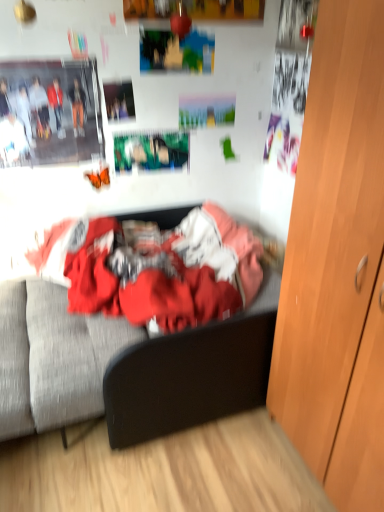
Question: Considering the positions of textured fabric bed at center and wooden cabinet at right in the image, is textured fabric bed at center taller or shorter than wooden cabinet at right?

Choices:
 (A) short
 (B) tall

Answer: (A)

Question: From a real-world perspective, is textured fabric bed at center above or below wooden cabinet at right?

Choices:
 (A) above
 (B) below

Answer: (B)

Question: Which is correct: textured fabric bed at center is inside wooden cabinet at right, or outside of it?

Choices:
 (A) inside
 (B) outside

Answer: (B)

Question: From a real-world perspective, is wooden cabinet at right positioned above or below textured fabric bed at center?

Choices:
 (A) above
 (B) below

Answer: (A)

Question: From the image's perspective, is wooden cabinet at right positioned above or below textured fabric bed at center?

Choices:
 (A) below
 (B) above

Answer: (A)

Question: Considering the positions of wooden cabinet at right and textured fabric bed at center in the image, is wooden cabinet at right bigger or smaller than textured fabric bed at center?

Choices:
 (A) big
 (B) small

Answer: (A)

Question: Considering the positions of wooden cabinet at right and textured fabric bed at center in the image, is wooden cabinet at right taller or shorter than textured fabric bed at center?

Choices:
 (A) short
 (B) tall

Answer: (B)